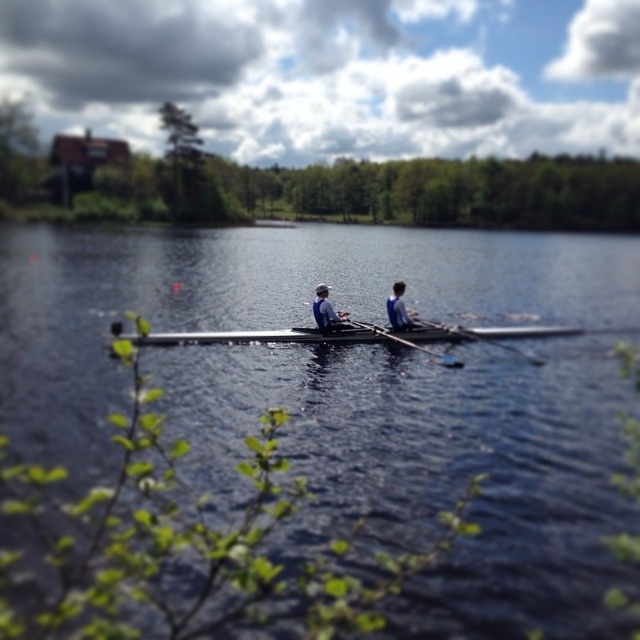
You are a photographer standing behind the trees and want to capture a closeup shot of the smooth wooden paddle at center and the blue fabric shirt at center. Your camera has a maximum focus range of 1.5 meters. Can you focus on both objects at the same time?

The distance between the smooth wooden paddle at center and the blue fabric shirt at center is 1.27 meters, which is within the camera focus range of 1.5 meters. Therefore, you can focus on both objects simultaneously.

You are a photographer trying to capture a closeup of the matte blue shirt at center and the wooden oar at center in the rowboat. Your camera has a maximum focus range of 1 meter. Will you be able to focus on both objects simultaneously?

The matte blue shirt at center and wooden oar at center are 1.02 meters apart. Since the distance between them exceeds the camera maximum focus range of 1 meter, you cannot focus on both objects simultaneously.